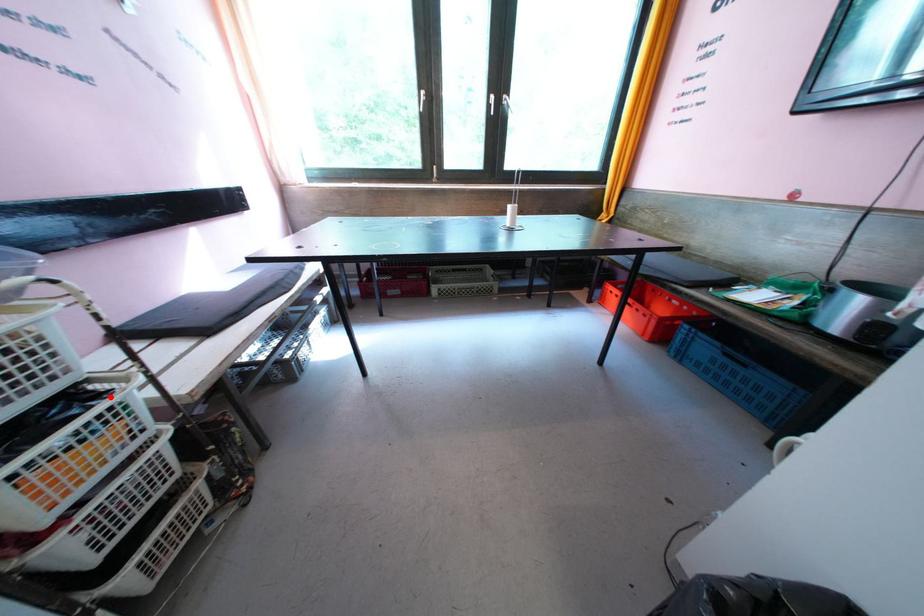
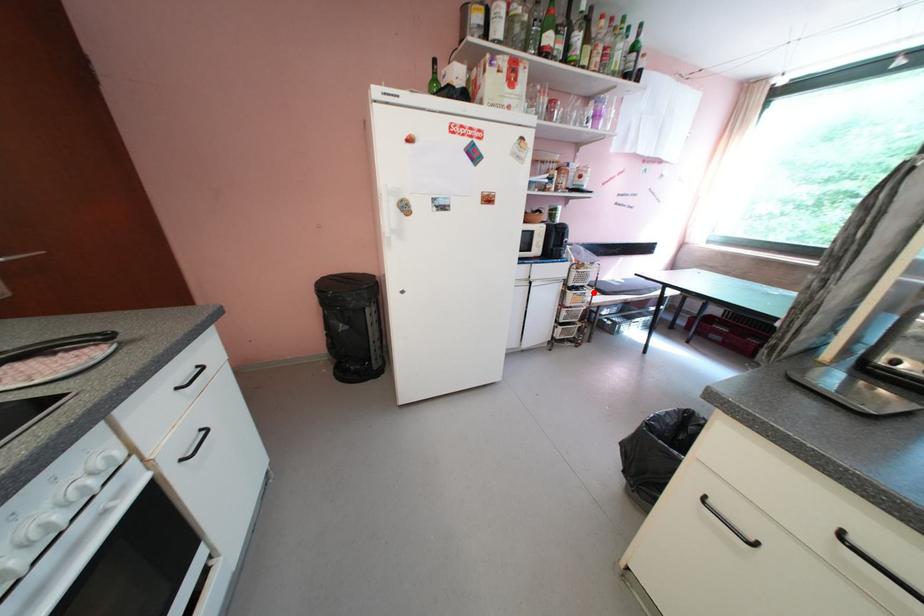
I am providing you with two images of the same scene from different viewpoints. A red point is marked on the first image and another point is marked on the second image. Are the points marked in image1 and image2 representing the same 3D position?

Yes